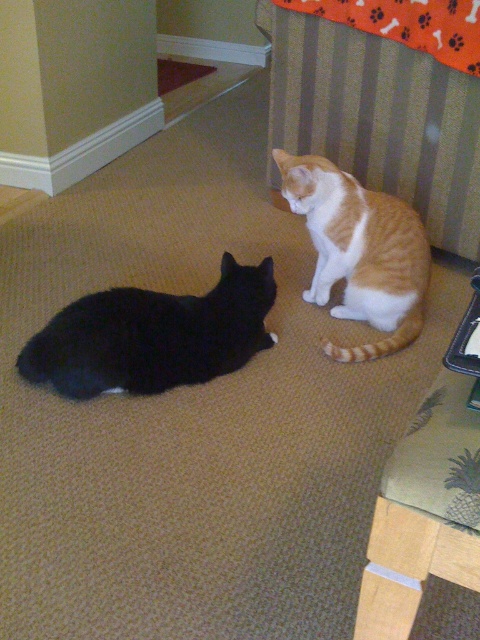
You are trying to decide which item takes up more horizontal space in the image. You see the black matte fur cat at lower left and the brown carpet at upper left. Which one is wider?

The black matte fur cat at lower left is wider than the brown carpet at upper left.